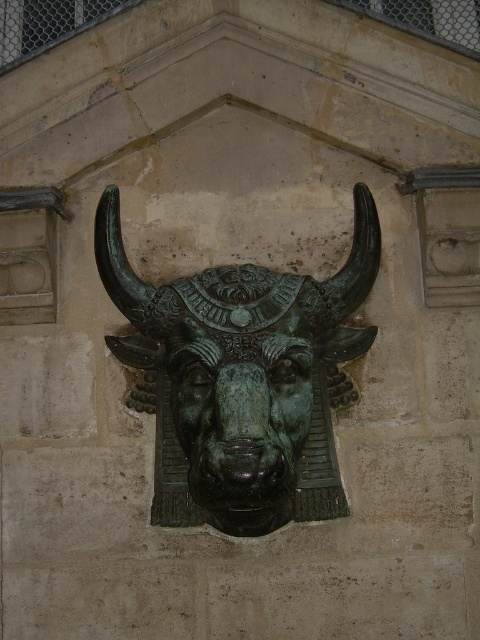
Does green patina bull at center lie behind green patina bull head at center?

Yes.

At what (x,y) coordinates should I click in order to perform the action: click on green patina bull at center. Please return your answer as a coordinate pair (x, y). The width and height of the screenshot is (480, 640). Looking at the image, I should click on (240, 374).

Image resolution: width=480 pixels, height=640 pixels. I want to click on green patina bull at center, so click(x=240, y=374).